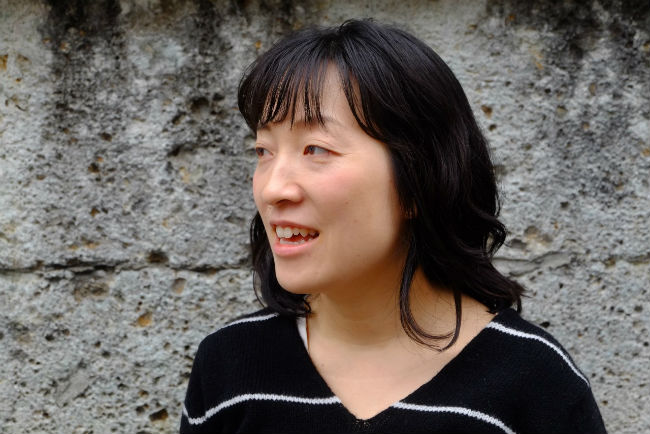
Where is `concrete wall`? This screenshot has height=434, width=650. concrete wall is located at coordinates (134, 212), (532, 92).